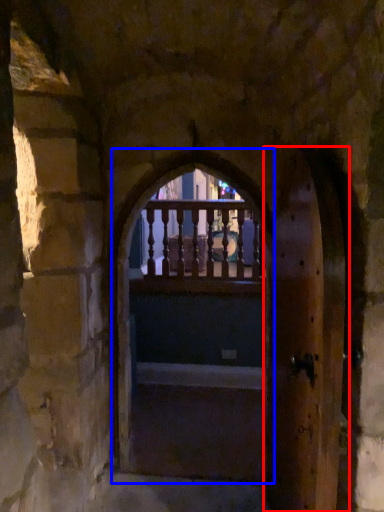
Question: Among these objects, which one is nearest to the camera, screen door (highlighted by a red box) or window frame (highlighted by a blue box)?

Choices:
 (A) screen door
 (B) window frame

Answer: (A)